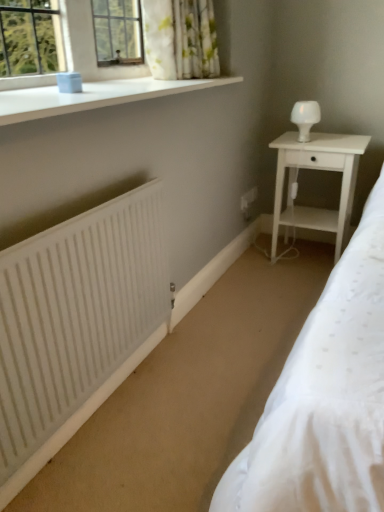
Where is `vacant area that lies to the right of white matte radiator at lower left`? This screenshot has width=384, height=512. vacant area that lies to the right of white matte radiator at lower left is located at coordinates (202, 385).